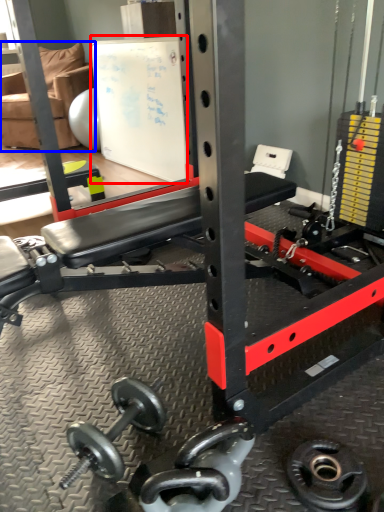
Question: Which object is closer to the camera taking this photo, bulletin board (highlighted by a red box) or chair (highlighted by a blue box)?

Choices:
 (A) bulletin board
 (B) chair

Answer: (A)